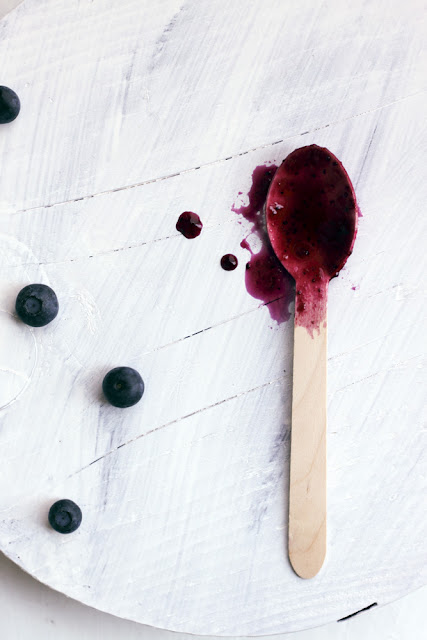
Locate an element on the screen. Image resolution: width=427 pixels, height=640 pixels. handle is located at coordinates (305, 390).